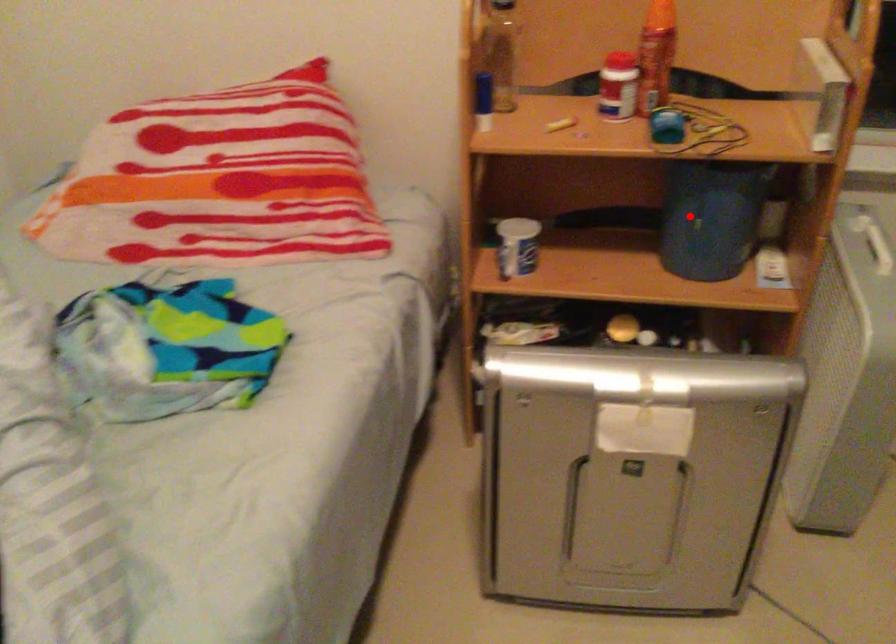
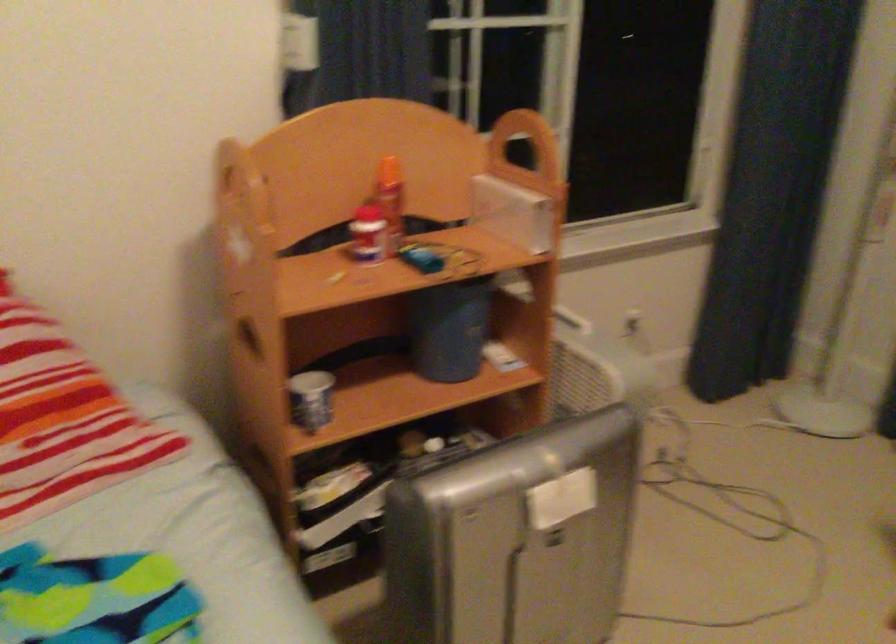
Question: I am providing you with two images of the same scene from different viewpoints. Image1 has a red point marked. In image2, the corresponding 3D location appears at what relative position? Reply with the corresponding letter.

Choices:
 (A) Closer
 (B) Farther

Answer: (B)